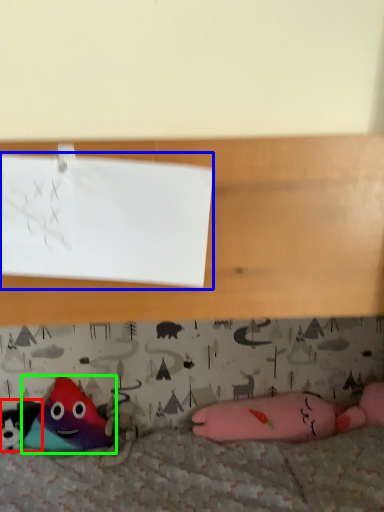
Question: Estimate the real-world distances between objects in this image. Which object is closer to toy (highlighted by a red box), paper (highlighted by a blue box) or toy (highlighted by a green box)?

Choices:
 (A) paper
 (B) toy

Answer: (B)